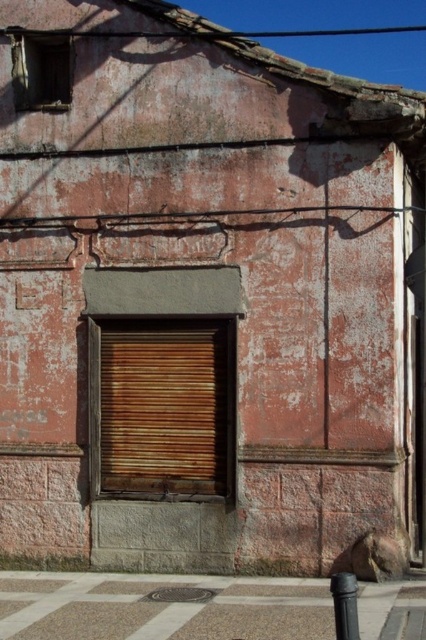
You are standing in front of the old building and want to place a small decorative plaque on the wall. The plaque must be placed at one of the two points marked as point 1 at point (157, 480) and point 2 at point (336, 598). Which point is closer to the lower gray stone section of the wall?

Point 2 at point (336, 598) is closer to the lower gray stone section of the wall because it is further down on the wall compared to point 1 at point (157, 480).

You are standing in front of the building and want to touch the rusty wood shutter at center. If you move your hand straight forward, will your hand reach the point at coordinates point (x=166, y=406) before touching any other part of the building?

Yes, because the point (x=166, y=406) corresponds to the rusty wood shutter at center, which is the first part of the building your hand would reach when moving forward.

You are a painter standing at the base of the building. You need to paint both the rusty wood shutter at center and the black matte pole at lower right. Which object will require a longer ladder to reach its top?

The rusty wood shutter at center has a greater height compared to the black matte pole at lower right, so you will need a longer ladder to reach the top of the rusty wood shutter at center.